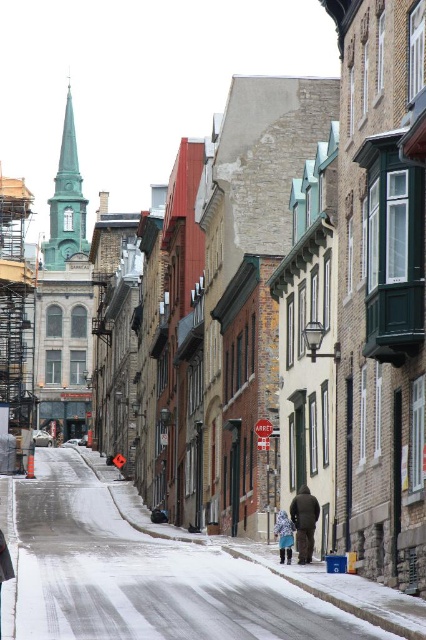
You are standing at the point with coordinates point (x=298, y=520) and want to walk towards the point (x=282, y=522). Which direction should you move to reach your destination?

You should move backward because point (x=298, y=520) is in front of point (x=282, y=522).

You are a delivery person standing at the start of the snow covered street. You need to deliver a package to the building with the tall green church steeple on the left. You see a dark brown leather jacket at center and a blue denim jacket at lower center. Which jacket is shorter in height?

The dark brown leather jacket at center is not as tall as the blue denim jacket at lower center, so the dark brown leather jacket at center is shorter in height.

You are a tourist standing on the snow covered street in the image. You see a dark brown leather jacket at center. Where exactly is the dark brown leather jacket located in terms of coordinates?

The dark brown leather jacket at center is located at point coordinates of (304, 522).